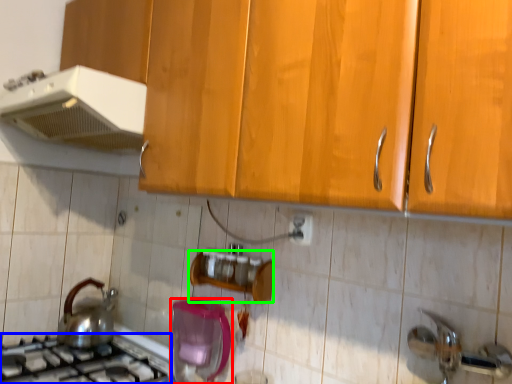
Question: Which object is the farthest from kitchen appliance (highlighted by a red box)? Choose among these: gas stove (highlighted by a blue box) or shelf (highlighted by a green box).

Choices:
 (A) gas stove
 (B) shelf

Answer: (A)